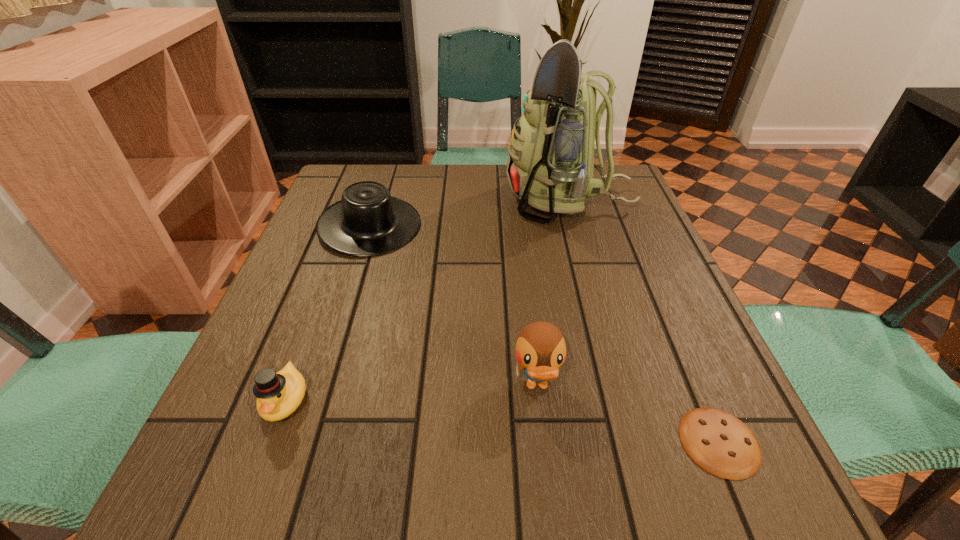
Identify the location of vacant area in the image that satisfies the following two spatial constraints: 1. on the front-facing side of the backpack; 2. on the front-facing side of the taller duck. The image size is (960, 540). (619, 386).

The image size is (960, 540). I want to click on vacant space that satisfies the following two spatial constraints: 1. on the front-facing side of the right duck; 2. on the left side of the cookie, so click(543, 442).

Identify the location of free space that satisfies the following two spatial constraints: 1. on the front-facing side of the shortest object; 2. on the left side of the left duck. (270, 442).

Locate an element on the screen. Image resolution: width=960 pixels, height=540 pixels. blank area in the image that satisfies the following two spatial constraints: 1. on the front-facing side of the cookie; 2. on the left side of the left duck is located at coordinates (270, 442).